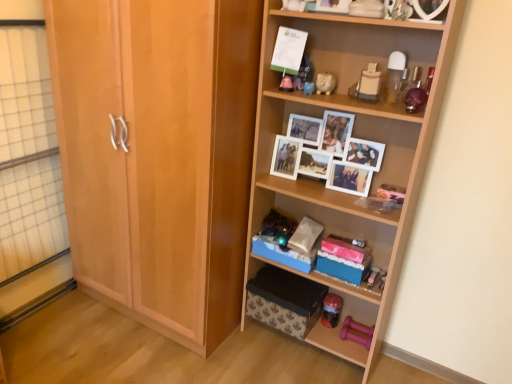
Question: Does matte pink piggy bank at upper center, which is counted as the 4th toy, starting from the top, have a greater height compared to white glossy piggy bank at upper center, marked as the 6th toy in a bottom-to-top arrangement?

Choices:
 (A) yes
 (B) no

Answer: (B)

Question: Can you confirm if matte pink piggy bank at upper center, positioned as the fourth toy in bottom-to-top order, is positioned to the right of white glossy piggy bank at upper center, marked as the 6th toy in a bottom-to-top arrangement?

Choices:
 (A) no
 (B) yes

Answer: (A)

Question: From a real-world perspective, does matte pink piggy bank at upper center, positioned as the fourth toy in bottom-to-top order, sit lower than white glossy piggy bank at upper center, marked as the 6th toy in a bottom-to-top arrangement?

Choices:
 (A) yes
 (B) no

Answer: (A)

Question: From a real-world perspective, does matte pink piggy bank at upper center, positioned as the fourth toy in bottom-to-top order, stand above white glossy piggy bank at upper center, the second toy viewed from the top?

Choices:
 (A) yes
 (B) no

Answer: (B)

Question: From the image's perspective, is matte pink piggy bank at upper center, positioned as the fourth toy in bottom-to-top order, under white glossy piggy bank at upper center, marked as the 6th toy in a bottom-to-top arrangement?

Choices:
 (A) no
 (B) yes

Answer: (B)

Question: Is the depth of matte pink piggy bank at upper center, which is counted as the 4th toy, starting from the top, greater than that of white glossy piggy bank at upper center, the second toy viewed from the top?

Choices:
 (A) yes
 (B) no

Answer: (A)

Question: From a real-world perspective, does matte plastic toy at upper center, the 5th toy when ordered from bottom to top, sit lower than white paper at upper center?

Choices:
 (A) yes
 (B) no

Answer: (A)

Question: From a real-world perspective, is matte plastic toy at upper center, the 5th toy when ordered from bottom to top, physically above white paper at upper center?

Choices:
 (A) yes
 (B) no

Answer: (B)

Question: Can you confirm if matte plastic toy at upper center, the 5th toy when ordered from bottom to top, is bigger than white paper at upper center?

Choices:
 (A) no
 (B) yes

Answer: (A)

Question: Can you confirm if matte plastic toy at upper center, arranged as the 3th toy when viewed from the top, is taller than white paper at upper center?

Choices:
 (A) yes
 (B) no

Answer: (B)

Question: Is matte plastic toy at upper center, arranged as the 3th toy when viewed from the top, located outside white paper at upper center?

Choices:
 (A) no
 (B) yes

Answer: (B)

Question: Does matte plastic toy at upper center, the 5th toy when ordered from bottom to top, appear on the left side of white paper at upper center?

Choices:
 (A) no
 (B) yes

Answer: (A)

Question: Is matte plastic toy at upper center, the 5th toy when ordered from bottom to top, smaller than transparent glass door at left?

Choices:
 (A) no
 (B) yes

Answer: (B)